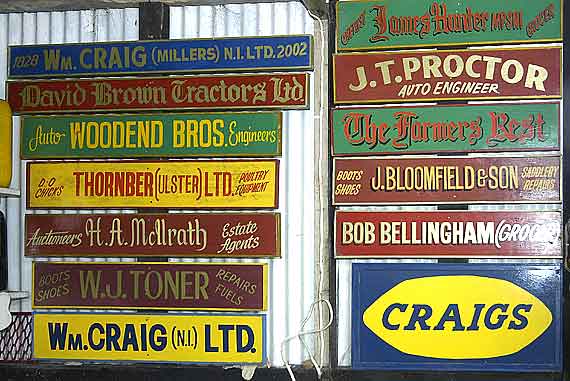
The height and width of the screenshot is (381, 570). I want to click on dark floor, so click(193, 374).